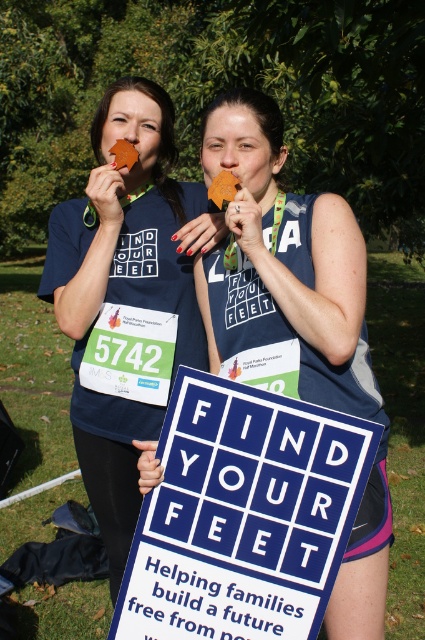
Who is more distant from viewer, [195,360] or [232,186]?

Point [195,360]

Who is higher up, matte blue t-shirt at center or brown paper leaf at center?

brown paper leaf at center is above.

Where is `matte blue t-shirt at center`? matte blue t-shirt at center is located at coordinates (125, 289).

Between point (167, 552) and point (176, 196), which one is positioned in front?

Point (167, 552) is more forward.

Locate an element on the screen. This screenshot has width=425, height=640. blue cardboard sign at center is located at coordinates (243, 515).

Locate an element on the screen. blue cardboard sign at center is located at coordinates (243, 515).

In order to click on blue cardboard sign at center in this screenshot , I will do `click(243, 515)`.

Which is more to the right, blue cardboard sign at center or matte blue tank top at center?

From the viewer's perspective, matte blue tank top at center appears more on the right side.

Describe the element at coordinates (243, 515) in the screenshot. The image size is (425, 640). I see `blue cardboard sign at center` at that location.

I want to click on blue cardboard sign at center, so click(x=243, y=515).